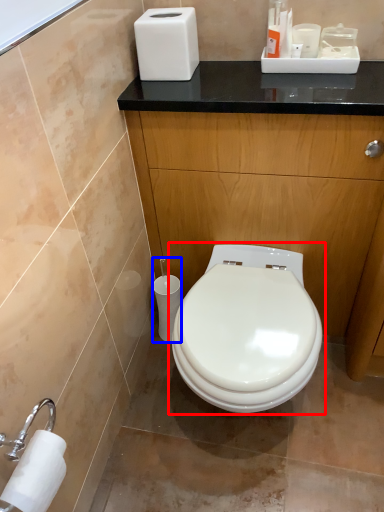
Question: Among these objects, which one is farthest to the camera, toilet (highlighted by a red box) or toilet paper (highlighted by a blue box)?

Choices:
 (A) toilet
 (B) toilet paper

Answer: (B)